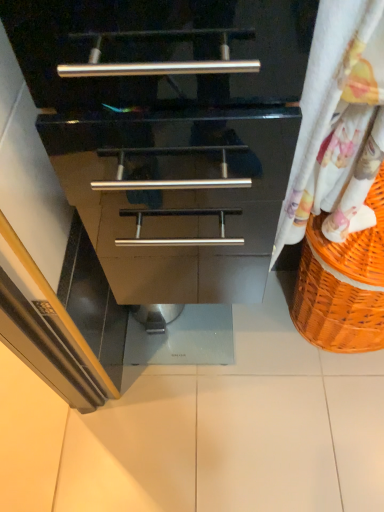
Describe the element at coordinates (334, 112) in the screenshot. I see `white floral fabric at right` at that location.

At what (x,y) coordinates should I click in order to perform the action: click on white glossy tile at center. Please return your answer as a coordinate pair (x, y). The width and height of the screenshot is (384, 512). Looking at the image, I should click on (184, 338).

Describe the element at coordinates (184, 338) in the screenshot. I see `white glossy tile at center` at that location.

You are a GUI agent. You are given a task and a screenshot of the screen. Output one action in this format:
    pyautogui.click(x=<x>, y=<y>)
    Task: Click on the white floral fabric at right
    This screenshot has height=512, width=384.
    Given the screenshot: What is the action you would take?
    pyautogui.click(x=334, y=112)

Could white glossy tile at center be considered to be inside white floral fabric at right?

No, white floral fabric at right does not contain white glossy tile at center.

Is white floral fabric at right directly adjacent to white glossy tile at center?

white floral fabric at right is not next to white glossy tile at center, and they're not touching.

From a real-world perspective, who is located higher, white floral fabric at right or white glossy tile at center?

white floral fabric at right is physically above.

Is white glossy tile at center placed right next to white floral fabric at right?

No, white glossy tile at center is not making contact with white floral fabric at right.

Consider the image. Is white glossy tile at center outside of white floral fabric at right?

Yes, white glossy tile at center is outside of white floral fabric at right.

Between white glossy tile at center and white floral fabric at right, which one appears on the right side from the viewer's perspective?

Positioned to the right is white floral fabric at right.

Where is `curtain that appears on the right of white glossy tile at center`? The image size is (384, 512). curtain that appears on the right of white glossy tile at center is located at coordinates (334, 112).

From the image's perspective, which one is positioned higher, white floral fabric at right or orange woven basket at right?

white floral fabric at right appears higher in the image.

Considering the relative positions of white floral fabric at right and orange woven basket at right in the image provided, is white floral fabric at right to the left of orange woven basket at right from the viewer's perspective?

Yes, white floral fabric at right is to the left of orange woven basket at right.

Could you tell me if white floral fabric at right is facing orange woven basket at right?

No, white floral fabric at right is not aimed at orange woven basket at right.

From the picture: From a real-world perspective, is orange woven basket at right located beneath white glossy tile at center?

Actually, orange woven basket at right is physically above white glossy tile at center in the real world.

From the image's perspective, between orange woven basket at right and white glossy tile at center, which one is located above?

orange woven basket at right, from the image's perspective.

Is orange woven basket at right not near white glossy tile at center?

orange woven basket at right is actually quite close to white glossy tile at center.

Is orange woven basket at right taller than white glossy tile at center?

Yes, orange woven basket at right is taller than white glossy tile at center.

Is white glossy tile at center in contact with orange woven basket at right?

No, white glossy tile at center is not touching orange woven basket at right.

Can orange woven basket at right be found inside white glossy tile at center?

Definitely not — orange woven basket at right is not inside white glossy tile at center.

Does white glossy tile at center lie in front of orange woven basket at right?

No, white glossy tile at center is further to the viewer.

From the image's perspective, who appears lower, orange woven basket at right or white floral fabric at right?

orange woven basket at right, from the image's perspective.

Does point (340, 252) appear closer or farther from the camera than point (313, 72)?

Point (340, 252) is farther from the camera than point (313, 72).

Does orange woven basket at right have a larger size compared to white floral fabric at right?

Indeed, orange woven basket at right has a larger size compared to white floral fabric at right.

What are the coordinates of `curtain located above the white glossy tile at center (from the image's perspective)` in the screenshot? It's located at (x=334, y=112).

The height and width of the screenshot is (512, 384). Find the location of `tile below the white floral fabric at right (from a real-world perspective)`. tile below the white floral fabric at right (from a real-world perspective) is located at coordinates [x=184, y=338].

From the image, which object appears to be farther from white floral fabric at right, white glossy tile at center or orange woven basket at right?

white glossy tile at center.

Estimate the real-world distances between objects in this image. Which object is closer to white glossy tile at center, orange woven basket at right or white floral fabric at right?

Based on the image, orange woven basket at right appears to be nearer to white glossy tile at center.

Looking at the image, which one is located closer to white glossy tile at center, white floral fabric at right or orange woven basket at right?

orange woven basket at right is closer to white glossy tile at center.

Based on their spatial positions, is white floral fabric at right or white glossy tile at center closer to orange woven basket at right?

Among the two, white floral fabric at right is located nearer to orange woven basket at right.

Considering their positions, is orange woven basket at right positioned further to white floral fabric at right than white glossy tile at center?

white glossy tile at center lies further to white floral fabric at right than the other object.

From the image, which object appears to be nearer to orange woven basket at right, white glossy tile at center or white floral fabric at right?

Among the two, white floral fabric at right is located nearer to orange woven basket at right.

Where is `basket between white floral fabric at right and white glossy tile at center from front to back`? The width and height of the screenshot is (384, 512). basket between white floral fabric at right and white glossy tile at center from front to back is located at coordinates (343, 284).